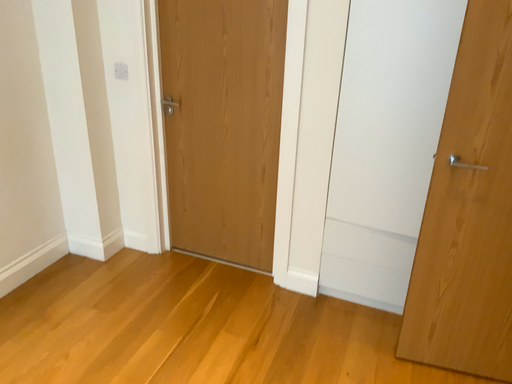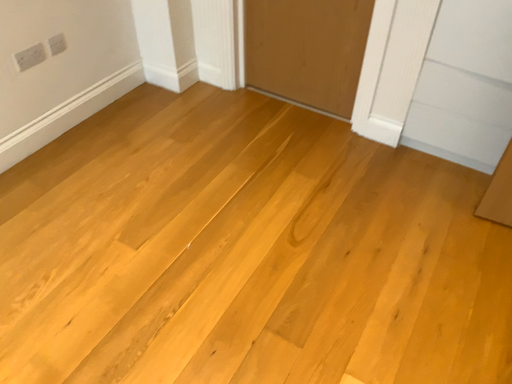
Question: Which way did the camera rotate in the video?

Choices:
 (A) rotated upward
 (B) rotated downward

Answer: (B)